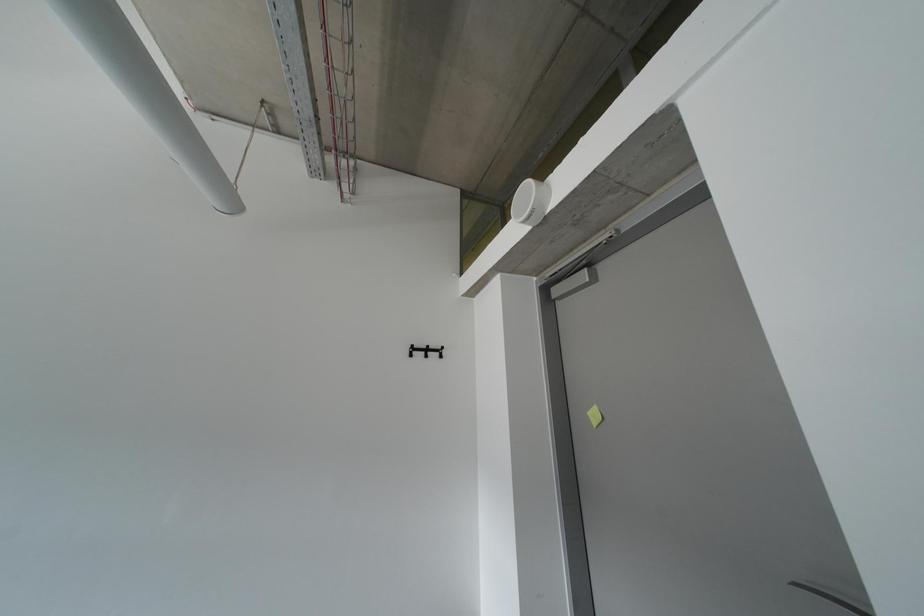
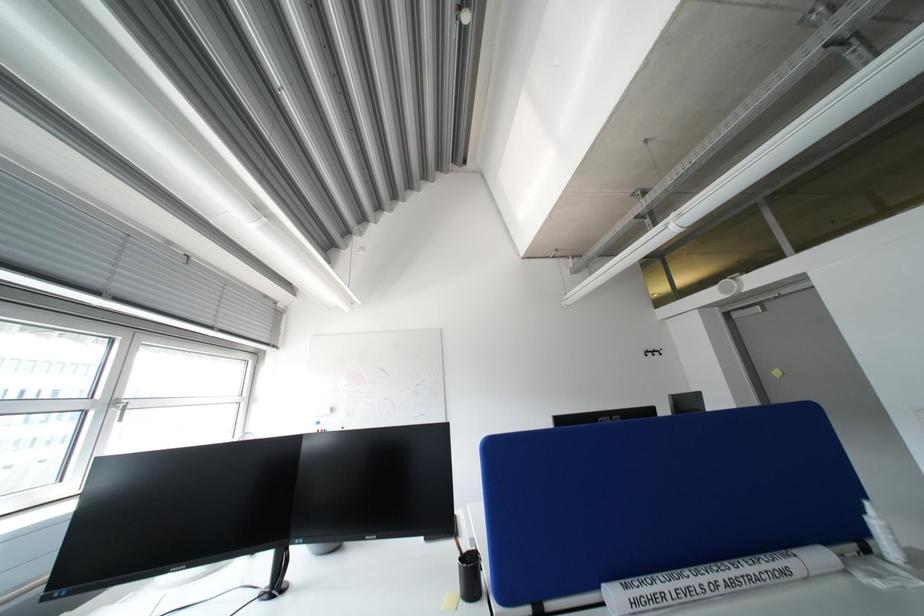
What movement of the cameraman would produce the second image?

The cameraman moved toward left, backward.